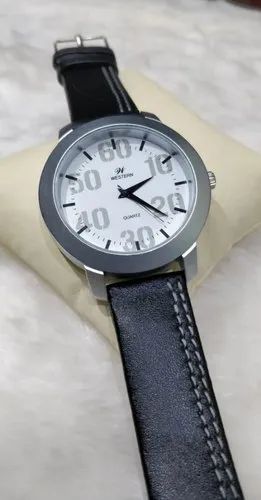
You are a GUI agent. You are given a task and a screenshot of the screen. Output one action in this format:
    pyautogui.click(x=<x>, y=<y>)
    Task: Click on the gray countertop
    
    Given the screenshot: What is the action you would take?
    pyautogui.click(x=192, y=40)